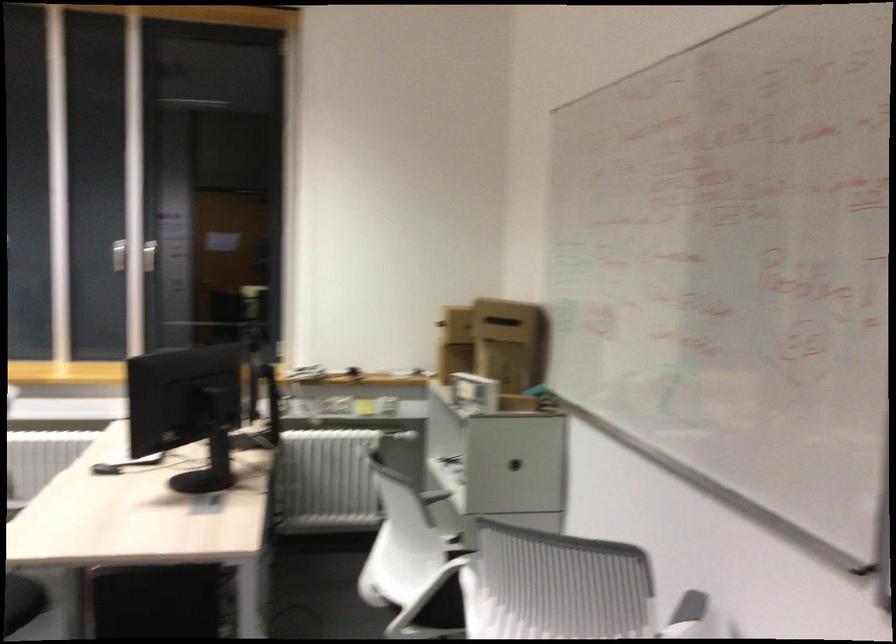
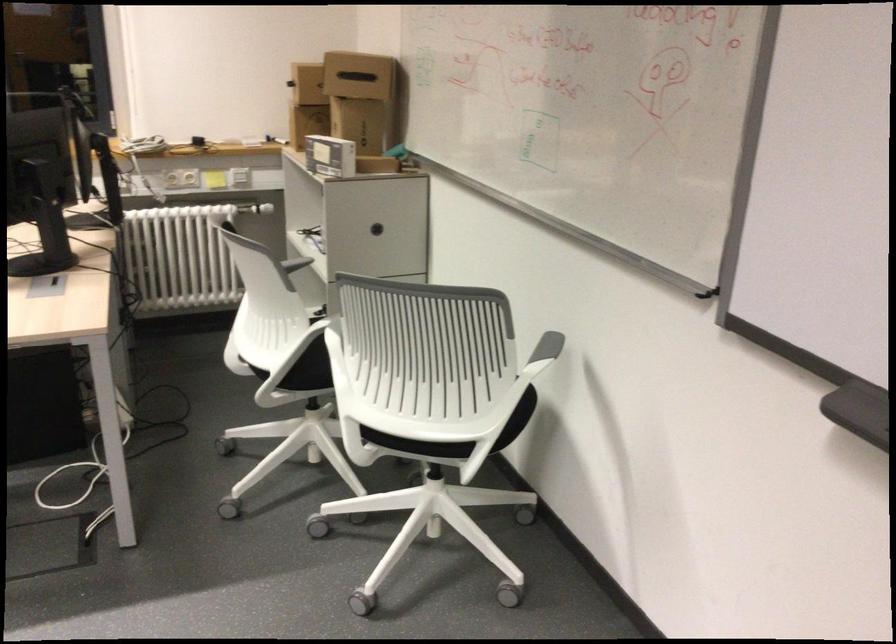
In the second image, find the point that corresponds to point (494, 310) in the first image.

(357, 76)